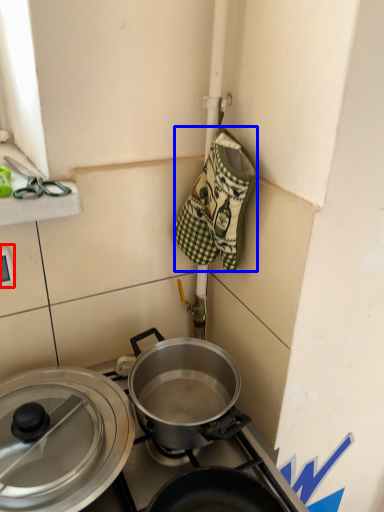
Question: Which object is closer to the camera taking this photo, electric outlet (highlighted by a red box) or material (highlighted by a blue box)?

Choices:
 (A) electric outlet
 (B) material

Answer: (B)